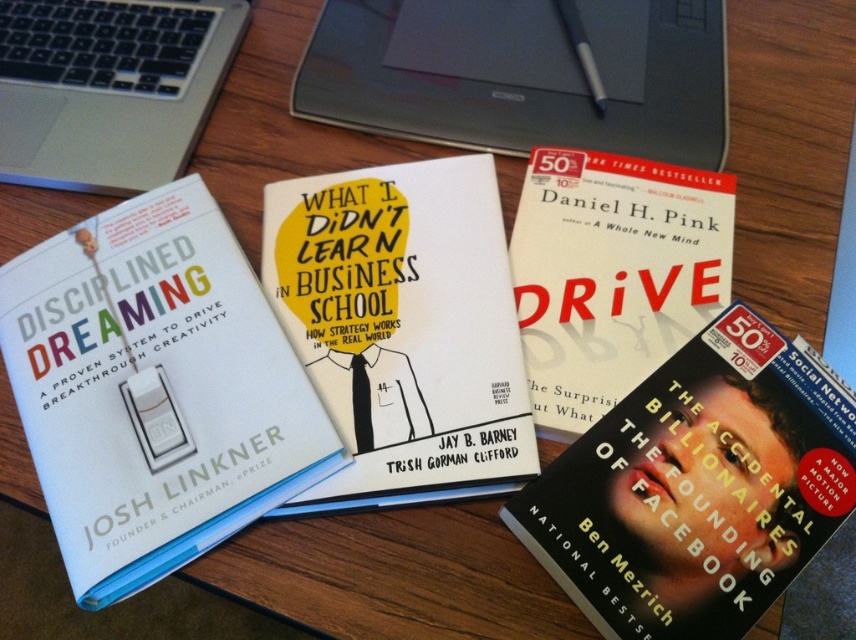
Between silver metallic laptop at upper center and hardcover book at center, which one is positioned lower?

Positioned lower is hardcover book at center.

How distant is silver metallic laptop at upper center from hardcover book at center?

A distance of 5.15 inches exists between silver metallic laptop at upper center and hardcover book at center.

Is point (304, 93) behind point (620, 228)?

Yes, it is.

Locate an element on the screen. This screenshot has width=856, height=640. silver metallic laptop at upper center is located at coordinates (522, 74).

From the picture: Is white matte book at left thinner than hardcover book at center?

No, white matte book at left is not thinner than hardcover book at center.

Is white matte book at left below hardcover book at center?

Yes, white matte book at left is below hardcover book at center.

Who is more forward, [107,232] or [617,349]?

Positioned in front is point [617,349].

You are a GUI agent. You are given a task and a screenshot of the screen. Output one action in this format:
    pyautogui.click(x=<x>, y=<y>)
    Task: Click on the white matte book at left
    The width and height of the screenshot is (856, 640).
    Given the screenshot: What is the action you would take?
    pyautogui.click(x=153, y=388)

Is point (605, 604) farther from viewer compared to point (708, 198)?

No.

Is point (657, 627) closer to camera compared to point (559, 337)?

Yes, it is.

Image resolution: width=856 pixels, height=640 pixels. Find the location of `black matte book at lower right`. black matte book at lower right is located at coordinates (697, 486).